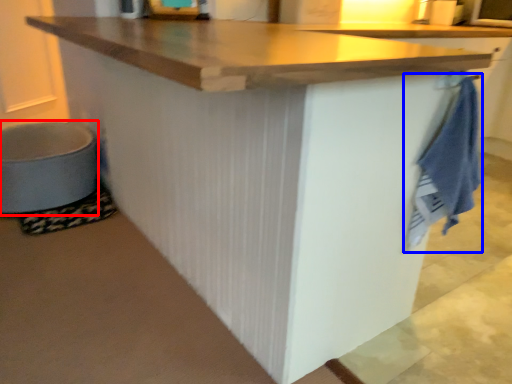
Question: Which point is further to the camera, step stool (highlighted by a red box) or bath towel (highlighted by a blue box)?

Choices:
 (A) step stool
 (B) bath towel

Answer: (A)